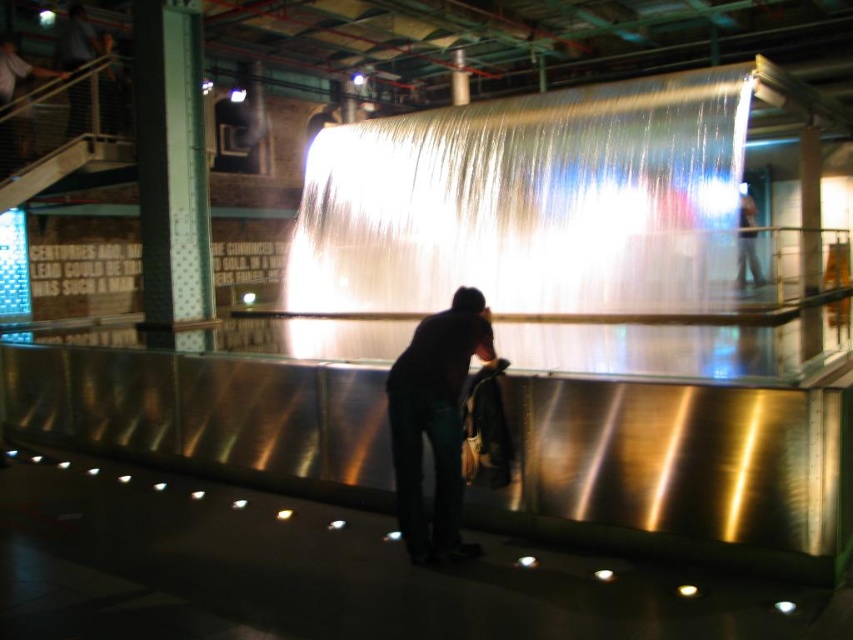
Question: Does translucent glass waterfall at center appear on the left side of dark blue jeans at upper right?

Choices:
 (A) yes
 (B) no

Answer: (A)

Question: Which of the following is the closest to the observer?

Choices:
 (A) (618, 301)
 (B) (747, 259)

Answer: (A)

Question: Which point appears closest to the camera in this image?

Choices:
 (A) pos(344,173)
 (B) pos(390,433)
 (C) pos(758,284)

Answer: (B)

Question: Does translucent glass waterfall at center appear on the right side of dark fabric bag at center?

Choices:
 (A) no
 (B) yes

Answer: (A)

Question: Does dark fabric bag at center appear over dark blue jeans at upper right?

Choices:
 (A) yes
 (B) no

Answer: (B)

Question: Which of these objects is positioned farthest from the translucent glass waterfall at center?

Choices:
 (A) dark blue jeans at upper right
 (B) dark fabric bag at center

Answer: (B)